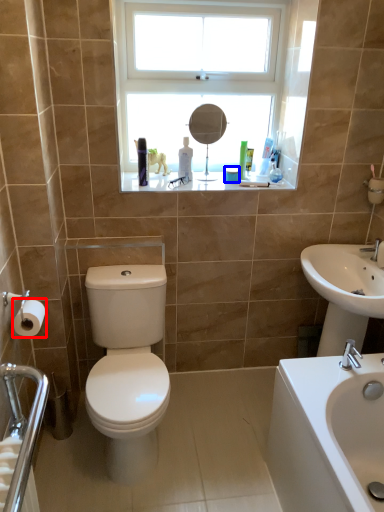
Question: Which object appears farthest to the camera in this image, toilet paper (highlighted by a red box) or toiletry (highlighted by a blue box)?

Choices:
 (A) toilet paper
 (B) toiletry

Answer: (B)